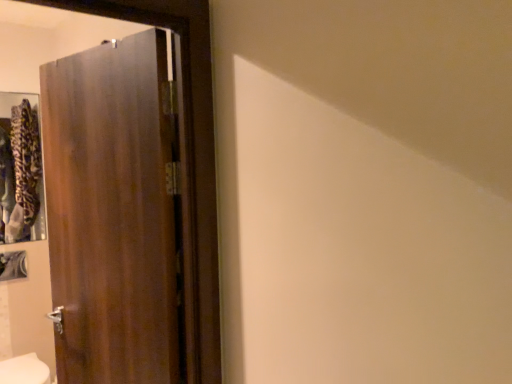
Question: Does dark wood door at left have a smaller size compared to white glossy bidet at lower left?

Choices:
 (A) no
 (B) yes

Answer: (A)

Question: Does dark wood door at left appear on the left side of white glossy bidet at lower left?

Choices:
 (A) no
 (B) yes

Answer: (A)

Question: Does dark wood door at left have a larger size compared to white glossy bidet at lower left?

Choices:
 (A) yes
 (B) no

Answer: (A)

Question: Is dark wood door at left taller than white glossy bidet at lower left?

Choices:
 (A) no
 (B) yes

Answer: (B)

Question: Does dark wood door at left have a lesser height compared to white glossy bidet at lower left?

Choices:
 (A) no
 (B) yes

Answer: (A)

Question: Can you confirm if dark wood door at left is wider than white glossy bidet at lower left?

Choices:
 (A) no
 (B) yes

Answer: (A)

Question: Can you confirm if white glossy bidet at lower left is bigger than dark wood door at left?

Choices:
 (A) yes
 (B) no

Answer: (B)

Question: Considering the relative sizes of white glossy bidet at lower left and dark wood door at left in the image provided, is white glossy bidet at lower left wider than dark wood door at left?

Choices:
 (A) yes
 (B) no

Answer: (A)

Question: Does white glossy bidet at lower left have a lesser width compared to dark wood door at left?

Choices:
 (A) yes
 (B) no

Answer: (B)

Question: Is white glossy bidet at lower left positioned behind dark wood door at left?

Choices:
 (A) no
 (B) yes

Answer: (B)

Question: Is white glossy bidet at lower left not near dark wood door at left?

Choices:
 (A) yes
 (B) no

Answer: (A)

Question: Is white glossy bidet at lower left located outside dark wood door at left?

Choices:
 (A) no
 (B) yes

Answer: (B)

Question: Is dark wood door at left spatially inside white glossy bidet at lower left, or outside of it?

Choices:
 (A) outside
 (B) inside

Answer: (A)